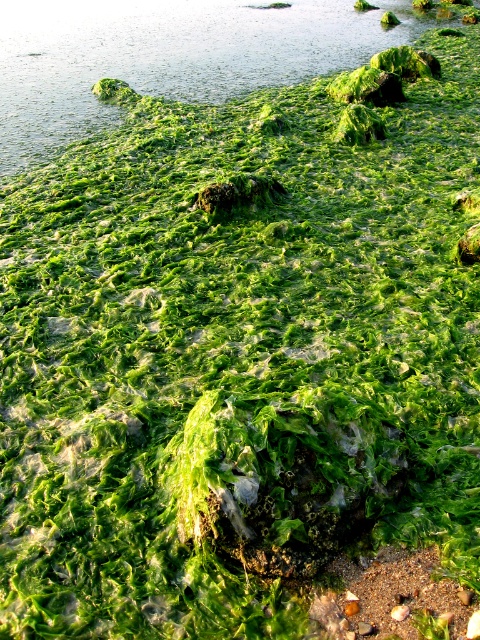
You are standing on a boat anchored 5 meters away from the rocky shoreline. You see the green algae at upper center. Can you reach it with a 4.5 meter long fishing rod?

The green algae at upper center and the viewer are 5.04 meters apart. Since the fishing rod is only 4.5 meters long, you cannot reach the green algae at upper center with it.

You are a marine biologist examining the shoreline. You notice the green algae at upper center and the smooth brown sand at bottom right. Based on their positions, which one is higher up in the image?

The green algae at upper center is located above the smooth brown sand at bottom right, so it is higher up in the image.

You are a marine biologist examining the rocky shoreline. You observe a specific point located at coordinates point [168,56]. Based on the scene description, what is the primary surface covering this point?

The point [168,56] is on green algae at upper center, so the primary surface covering this point is green algae.